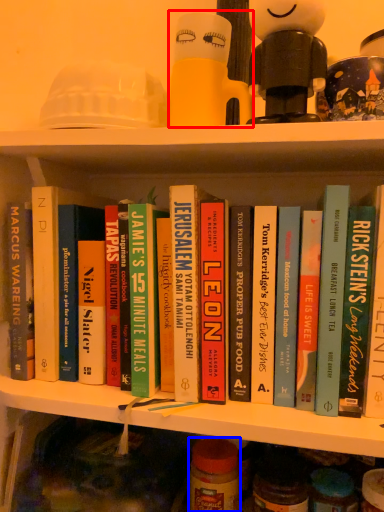
Question: Which object appears farthest to the camera in this image, toy (highlighted by a red box) or glass jar (highlighted by a blue box)?

Choices:
 (A) toy
 (B) glass jar

Answer: (B)